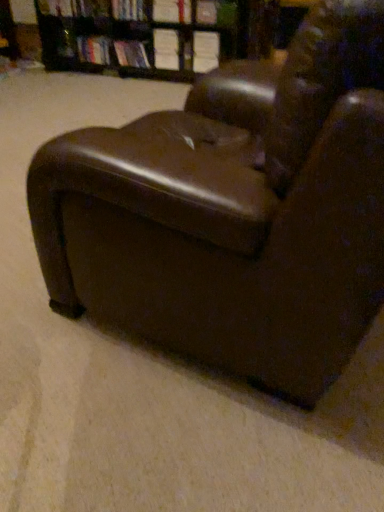
Question: Can you confirm if hardcover book at center, arranged as the first book when viewed from the right, is bigger than white paper book at upper center, arranged as the third book when viewed from the right?

Choices:
 (A) no
 (B) yes

Answer: (B)

Question: Is hardcover book at center, positioned as the 6th book in left-to-right order, completely or partially outside of white paper book at upper center, the fourth book from the left?

Choices:
 (A) no
 (B) yes

Answer: (B)

Question: Could you tell me if hardcover book at center, positioned as the 6th book in left-to-right order, is facing white paper book at upper center, the fourth book from the left?

Choices:
 (A) yes
 (B) no

Answer: (B)

Question: From a real-world perspective, is hardcover book at center, arranged as the first book when viewed from the right, on top of white paper book at upper center, the fourth book from the left?

Choices:
 (A) no
 (B) yes

Answer: (B)

Question: From the image's perspective, is hardcover book at center, arranged as the first book when viewed from the right, located above white paper book at upper center, arranged as the third book when viewed from the right?

Choices:
 (A) yes
 (B) no

Answer: (A)

Question: Is hardcover book at center, positioned as the 6th book in left-to-right order, positioned in front of white paper book at upper center, the fourth book from the left?

Choices:
 (A) yes
 (B) no

Answer: (A)

Question: Considering the relative sizes of hardcover book at upper center, which ranks as the second book in left-to-right order, and brown leather bookcase at upper center in the image provided, is hardcover book at upper center, which ranks as the second book in left-to-right order, thinner than brown leather bookcase at upper center?

Choices:
 (A) yes
 (B) no

Answer: (A)

Question: Does hardcover book at upper center, which appears as the fifth book when viewed from the right, have a smaller size compared to brown leather bookcase at upper center?

Choices:
 (A) yes
 (B) no

Answer: (A)

Question: Does hardcover book at upper center, which appears as the fifth book when viewed from the right, lie behind brown leather bookcase at upper center?

Choices:
 (A) no
 (B) yes

Answer: (B)

Question: Does hardcover book at upper center, which ranks as the second book in left-to-right order, come in front of brown leather bookcase at upper center?

Choices:
 (A) yes
 (B) no

Answer: (B)

Question: Would you say hardcover book at upper center, which ranks as the second book in left-to-right order, contains brown leather bookcase at upper center?

Choices:
 (A) yes
 (B) no

Answer: (B)

Question: Is hardcover book at upper center, which appears as the fifth book when viewed from the right, at the right side of brown leather bookcase at upper center?

Choices:
 (A) no
 (B) yes

Answer: (A)

Question: Does brown leather armchair at center lie in front of white paper book at upper center, which ranks as the 5th book in left-to-right order?

Choices:
 (A) yes
 (B) no

Answer: (A)